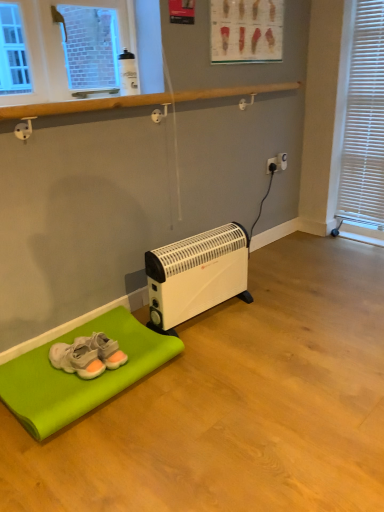
Find the location of a particular element. The height and width of the screenshot is (512, 384). blank space to the left of gray suede sneakers at lower left is located at coordinates (31, 372).